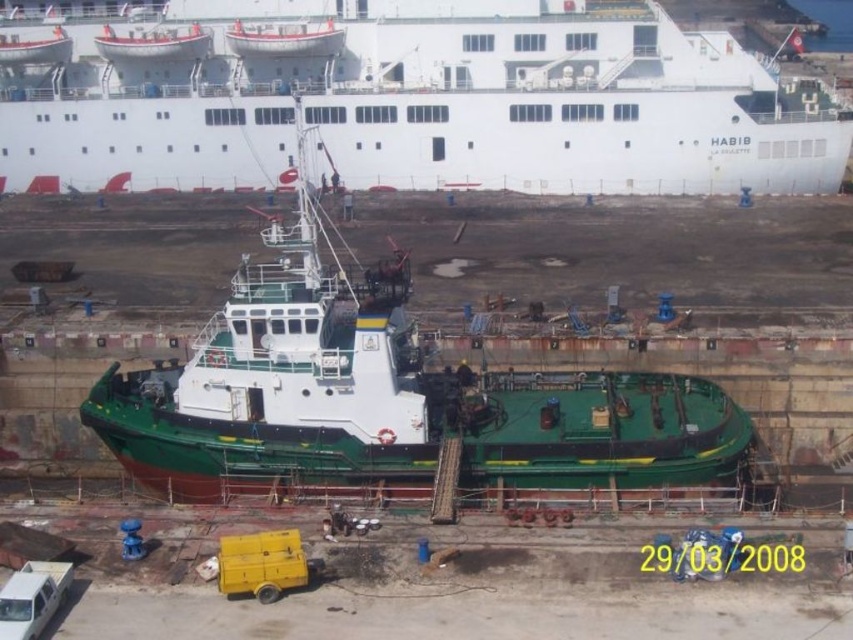
Question: Based on their relative distances, which object is nearer to the green matte tugboat at center?

Choices:
 (A) white glossy lifeboat at upper center
 (B) white glossy cruise ship at upper center

Answer: (B)

Question: Where is white glossy cruise ship at upper center located in relation to green matte tugboat at center in the image?

Choices:
 (A) right
 (B) left

Answer: (A)

Question: Considering the real-world distances, which object is closest to the green matte tugboat at center?

Choices:
 (A) white glossy lifeboat at upper center
 (B) white glossy cruise ship at upper center

Answer: (B)

Question: Is white glossy cruise ship at upper center smaller than white glossy lifeboat at upper center?

Choices:
 (A) no
 (B) yes

Answer: (A)

Question: Considering the real-world distances, which object is farthest from the green matte tugboat at center?

Choices:
 (A) white glossy cruise ship at upper center
 (B) white glossy lifeboat at upper center

Answer: (B)

Question: Can you confirm if green matte tugboat at center is positioned above white glossy lifeboat at upper center?

Choices:
 (A) yes
 (B) no

Answer: (B)